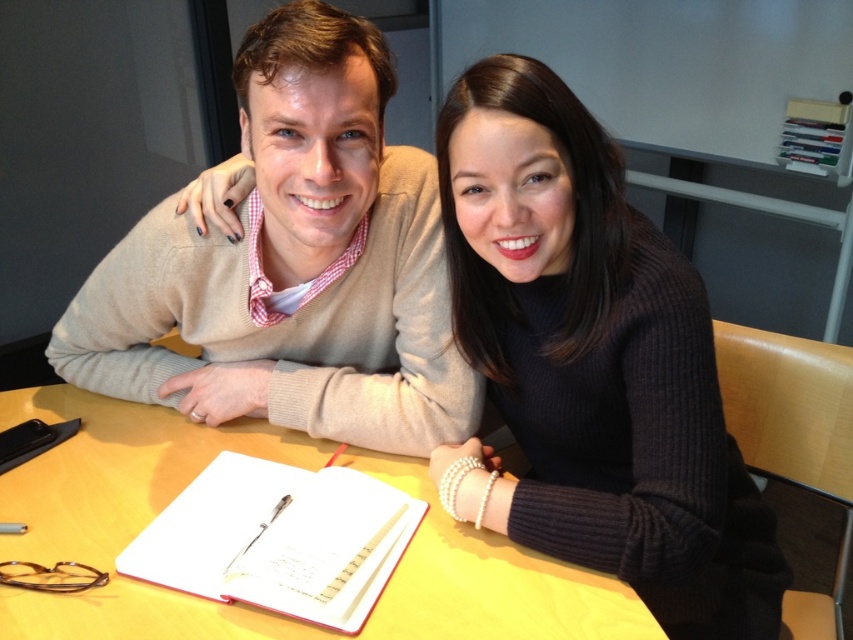
You are a delivery robot with a package that needs to be placed between the black ribbed sweater at center and the red matte notebook at center. The package is 12 inches long. Will it fit in the space between them?

The space between the black ribbed sweater at center and the red matte notebook at center is 11.51 inches. Since the package is 12 inches long, it will not fit in the space between them.

Based on the photo, you are standing in front of the table where the two people are sitting. You need to place a small object on the table. If you want to place it closer to you, which point should you choose between point (520, 83) and point (256, 520)?

Point (520, 83) is closer to the viewer than point (256, 520), so you should choose point (520, 83) to place the object closer to you.

You are organizing a small event and need to place a decorative item on the table between the black ribbed sweater at center and the red matte notebook at center. Which object should you place the item closer to if you want it to be closer to the taller object?

The black ribbed sweater at center is taller than the red matte notebook at center, so you should place the decorative item closer to the black ribbed sweater at center.